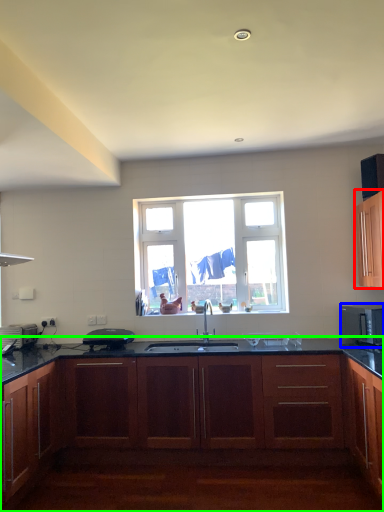
Question: Considering the real-world distances, which object is farthest from cabinetry (highlighted by a red box)? microwave oven (highlighted by a blue box) or cabinetry (highlighted by a green box)?

Choices:
 (A) microwave oven
 (B) cabinetry

Answer: (B)